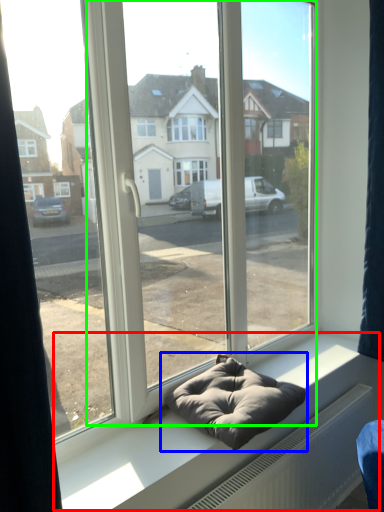
Question: Based on their relative distances, which object is nearer to window sill (highlighted by a red box)? Choose from bean bag chair (highlighted by a blue box) and glass door (highlighted by a green box).

Choices:
 (A) bean bag chair
 (B) glass door

Answer: (A)